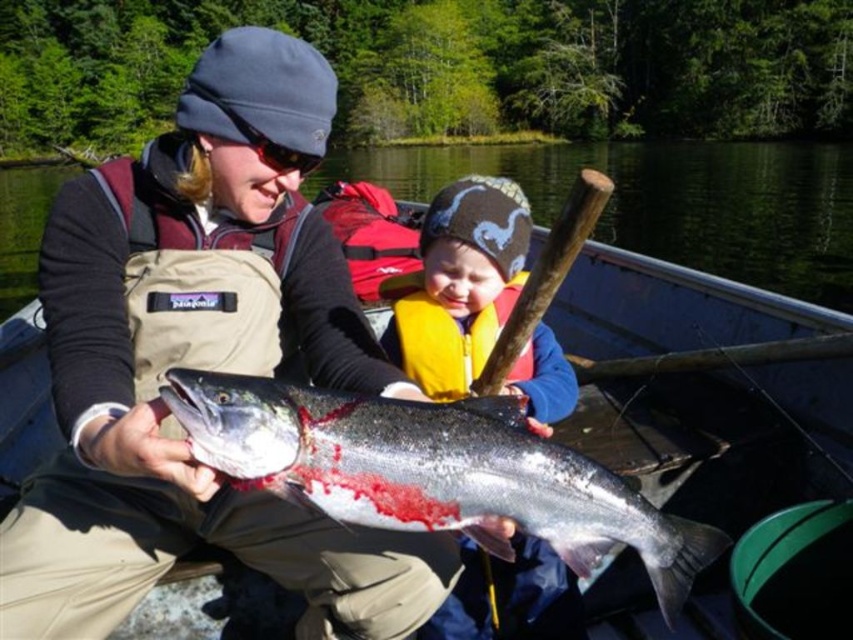
Can you confirm if matte blue jacket at center is positioned to the left of yellow life jacket at center?

Indeed, matte blue jacket at center is positioned on the left side of yellow life jacket at center.

Can you confirm if matte blue jacket at center is taller than yellow life jacket at center?

Yes.

This screenshot has height=640, width=853. Find the location of `matte blue jacket at center`. matte blue jacket at center is located at coordinates (459, 284).

Is shiny silver fish at center smaller than yellow life jacket at center?

No.

Does point (519, 406) lie in front of point (523, 346)?

Yes, it is.

Image resolution: width=853 pixels, height=640 pixels. What do you see at coordinates (432, 472) in the screenshot? I see `shiny silver fish at center` at bounding box center [432, 472].

At what (x,y) coordinates should I click in order to perform the action: click on shiny silver fish at center. Please return your answer as a coordinate pair (x, y). The width and height of the screenshot is (853, 640). Looking at the image, I should click on (432, 472).

Between blue plastic boat at center and yellow life jacket at center, which one has less height?

yellow life jacket at center is shorter.

Describe the element at coordinates (705, 385) in the screenshot. I see `blue plastic boat at center` at that location.

The height and width of the screenshot is (640, 853). Find the location of `blue plastic boat at center`. blue plastic boat at center is located at coordinates (705, 385).

Locate an element on the screen. This screenshot has height=640, width=853. blue plastic boat at center is located at coordinates (705, 385).